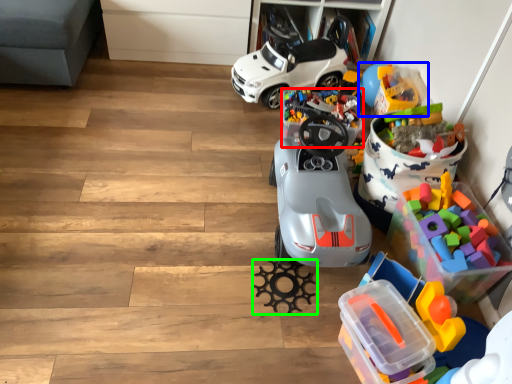
Question: Based on their relative distances, which object is nearer to toy (highlighted by a red box)? Choose from toy (highlighted by a blue box) and toy (highlighted by a green box).

Choices:
 (A) toy
 (B) toy

Answer: (A)